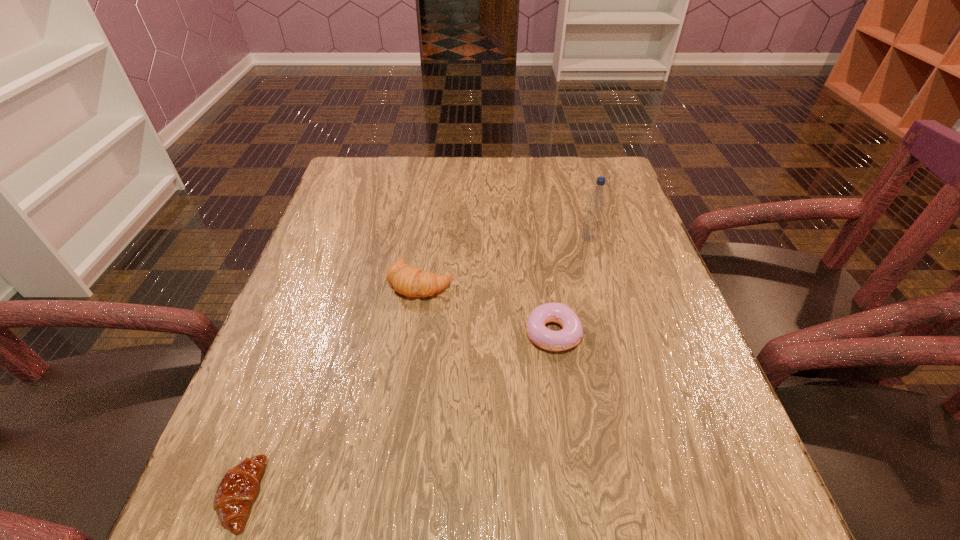
This screenshot has height=540, width=960. In order to click on vacant region located 0.130m on the left of the second shortest object in this screenshot , I will do `click(460, 333)`.

You are a GUI agent. You are given a task and a screenshot of the screen. Output one action in this format:
    pyautogui.click(x=<x>, y=<y>)
    Task: Click on the vacant space situated 0.130m on the back of the shorter crescent roll
    The width and height of the screenshot is (960, 540).
    Given the screenshot: What is the action you would take?
    pyautogui.click(x=281, y=386)

Locate an element on the screen. object that is at the near edge is located at coordinates (237, 489).

Identify the location of object located at the left edge. (237, 489).

You are a GUI agent. You are given a task and a screenshot of the screen. Output one action in this format:
    pyautogui.click(x=<x>, y=<y>)
    Task: Click on the object at the right edge
    The width and height of the screenshot is (960, 540).
    Given the screenshot: What is the action you would take?
    pyautogui.click(x=596, y=202)

At what (x,y) coordinates should I click in order to perform the action: click on object situated at the near left corner. Please return your answer as a coordinate pair (x, y). The width and height of the screenshot is (960, 540). Looking at the image, I should click on (237, 489).

Locate an element on the screen. This screenshot has width=960, height=540. free location at the far edge is located at coordinates (449, 181).

In order to click on free spot at the near edge of the desktop in this screenshot , I will do `click(435, 534)`.

I want to click on vacant region at the left edge of the desktop, so click(x=330, y=415).

Identify the location of free space at the right edge of the desktop. The image size is (960, 540). (691, 456).